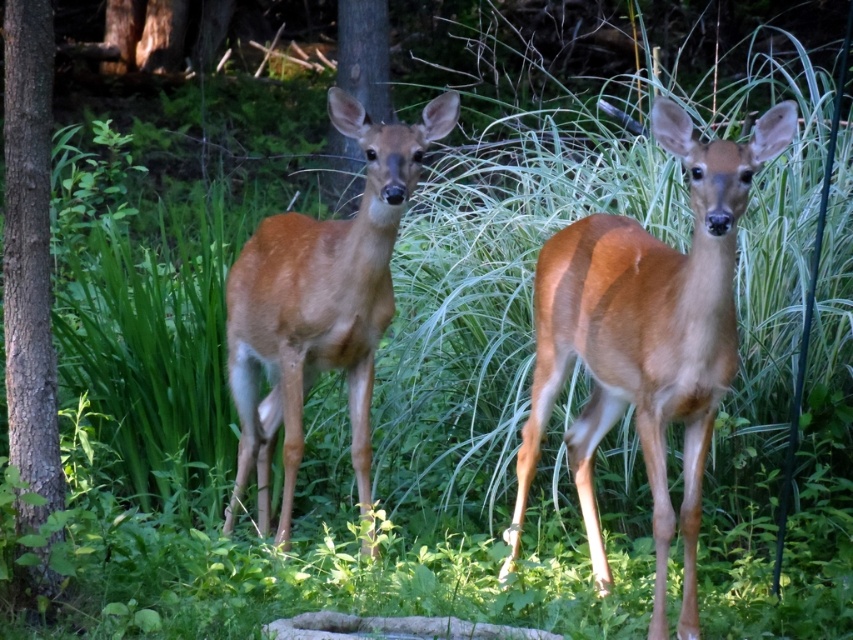
Image resolution: width=853 pixels, height=640 pixels. Describe the element at coordinates (318, 304) in the screenshot. I see `brown fur deer at center` at that location.

Does brown fur deer at center come in front of brown rough bark tree at left?

That is False.

Between point (368, 385) and point (42, 564), which one is positioned in front?

Positioned in front is point (42, 564).

Where is `brown fur deer at center`? brown fur deer at center is located at coordinates (318, 304).

Find the location of a particular element. The width and height of the screenshot is (853, 640). brown matte/deer at center is located at coordinates (646, 339).

Image resolution: width=853 pixels, height=640 pixels. What do you see at coordinates (646, 339) in the screenshot?
I see `brown matte/deer at center` at bounding box center [646, 339].

At what (x,y) coordinates should I click in order to perform the action: click on brown matte/deer at center. Please return your answer as a coordinate pair (x, y). The height and width of the screenshot is (640, 853). Looking at the image, I should click on (646, 339).

Where is `brown matte/deer at center`? The image size is (853, 640). brown matte/deer at center is located at coordinates (646, 339).

Which of these two, brown rough bark tree at left or brown wood tree at center, stands taller?

With more height is brown rough bark tree at left.

Is brown rough bark tree at left wider than brown wood tree at center?

In fact, brown rough bark tree at left might be narrower than brown wood tree at center.

Find the location of a particular element. The height and width of the screenshot is (640, 853). brown rough bark tree at left is located at coordinates (28, 259).